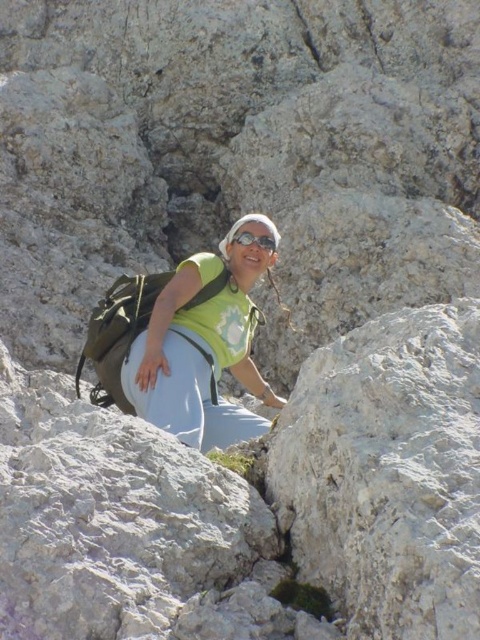
You are a photographer trying to capture the climber in the image. The green matte shirt at center and transparent plastic goggles at center are both in your viewfinder. Which object should you focus on if you want to highlight the one that is taller?

The green matte shirt at center is taller than the transparent plastic goggles at center, so you should focus on the green matte shirt at center to highlight the taller object.

You are analyzing the position of the green matte shirt at center in the image. What are the coordinates of its location?

The 2D location of the green matte shirt at center is at point (203, 346).

You are a hiker trying to navigate through the rocky terrain shown in the image. You notice two points marked on the rock face. Which point, point (233, 289) or point (251, 243), is closer to you?

Point (233, 289) is closer to the viewer than point (251, 243).